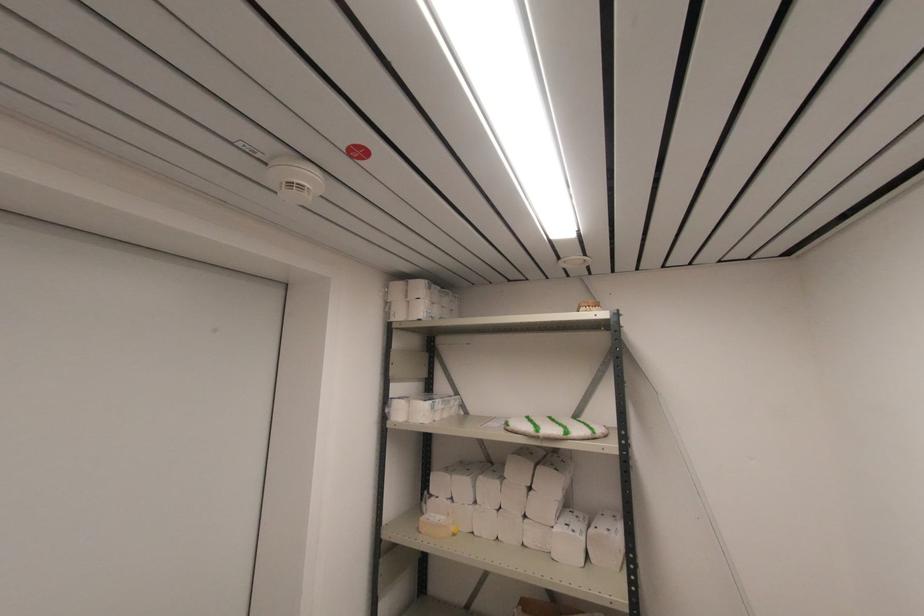
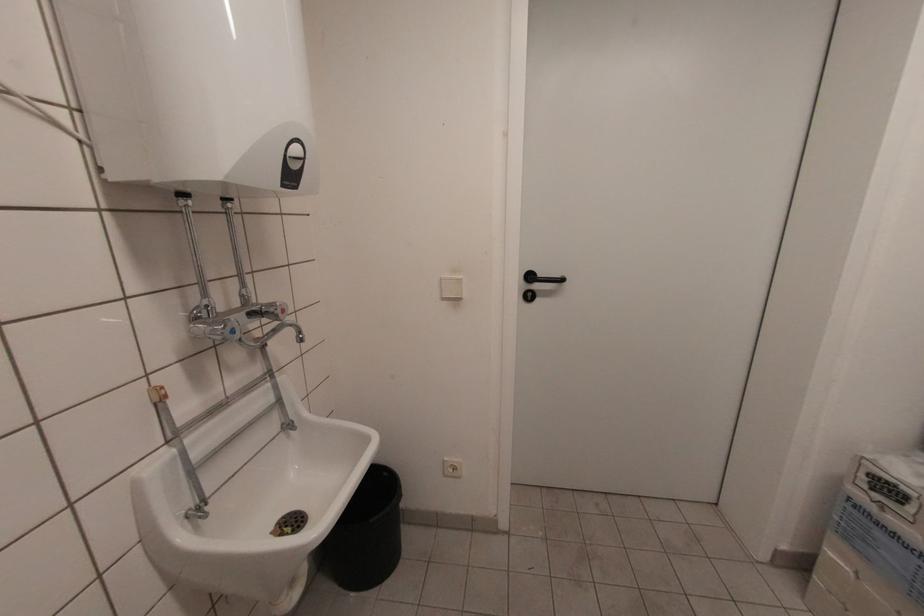
How did the camera likely rotate?

The camera rotated toward left-down.